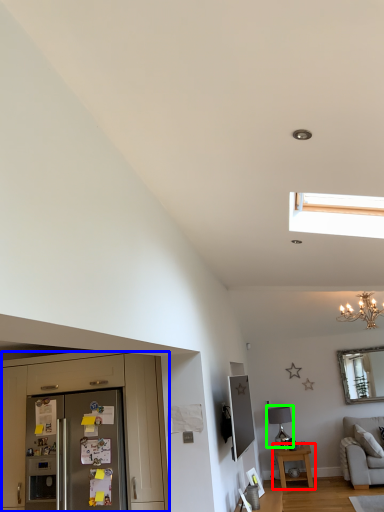
Question: Considering the real-world distances, which object is closest to table (highlighted by a red box)? cabinetry (highlighted by a blue box) or lamp (highlighted by a green box).

Choices:
 (A) cabinetry
 (B) lamp

Answer: (B)